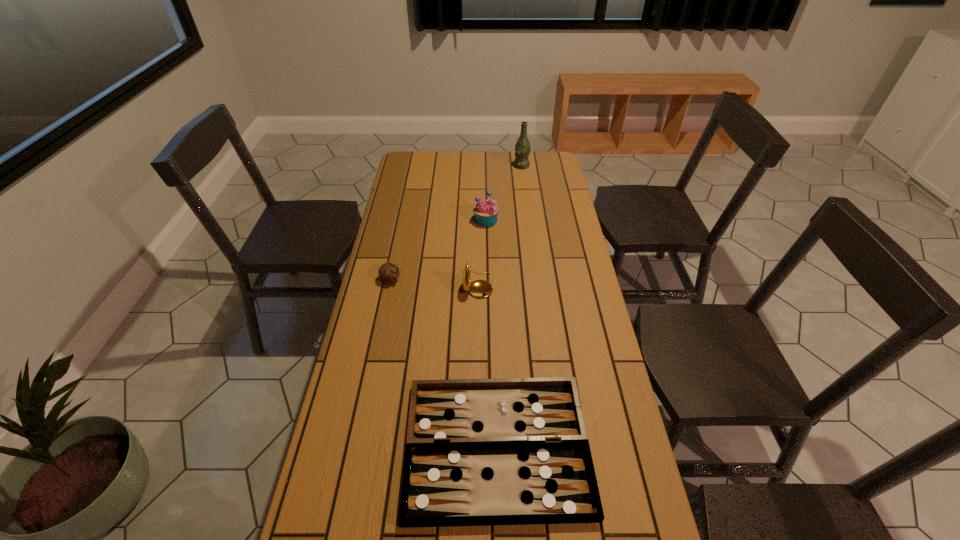
Where is `blank area in the image that satisfies the following two spatial constraints: 1. on the face of the pocket watch; 2. on the right side of the nearest object`? The height and width of the screenshot is (540, 960). blank area in the image that satisfies the following two spatial constraints: 1. on the face of the pocket watch; 2. on the right side of the nearest object is located at coordinates (476, 447).